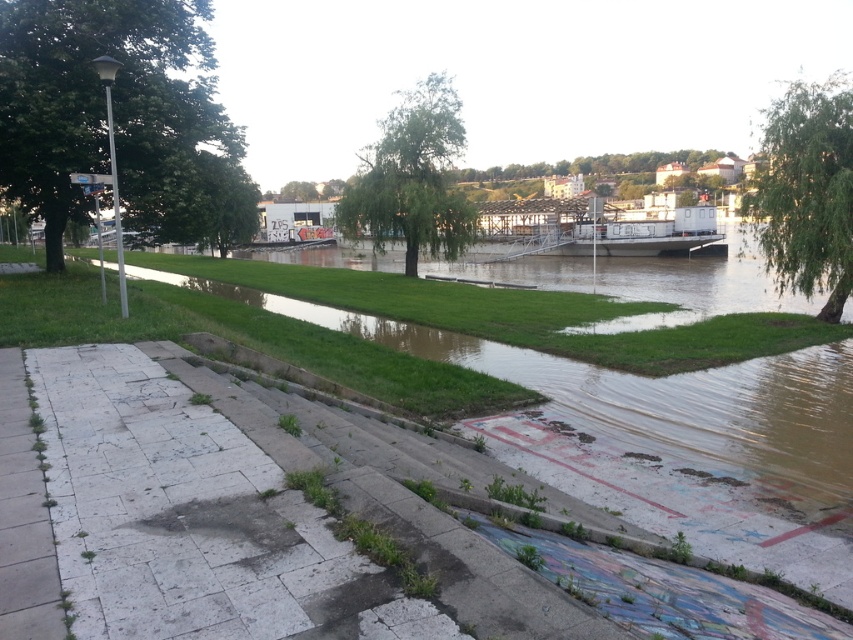
Can you confirm if green leafy tree at upper right is positioned to the right of green leafy tree at center?

Correct, you'll find green leafy tree at upper right to the right of green leafy tree at center.

Which is in front, point (819, 259) or point (442, 243)?

Point (819, 259)

Is point (816, 248) closer to camera compared to point (439, 244)?

Yes.

Locate an element on the screen. This screenshot has height=640, width=853. green leafy tree at upper right is located at coordinates click(807, 192).

Between point (212, 440) and point (790, 221), which one is positioned behind?

The point (790, 221) is behind.

Which of these two, gray concrete steps at lower left or green leafy tree at upper right, stands shorter?

With less height is gray concrete steps at lower left.

Is point (367, 580) closer to viewer compared to point (775, 256)?

Yes.

Locate an element on the screen. The width and height of the screenshot is (853, 640). gray concrete steps at lower left is located at coordinates (192, 518).

Between green leafy tree at upper right and green leafy tree at upper center, which one appears on the left side from the viewer's perspective?

From the viewer's perspective, green leafy tree at upper right appears more on the left side.

Looking at this image, who is taller, green leafy tree at upper right or green leafy tree at upper center?

Standing taller between the two is green leafy tree at upper center.

Between point (778, 218) and point (496, 170), which one is positioned in front?

Point (778, 218)

At what (x,y) coordinates should I click in order to perform the action: click on green leafy tree at upper right. Please return your answer as a coordinate pair (x, y). Looking at the image, I should click on (807, 192).